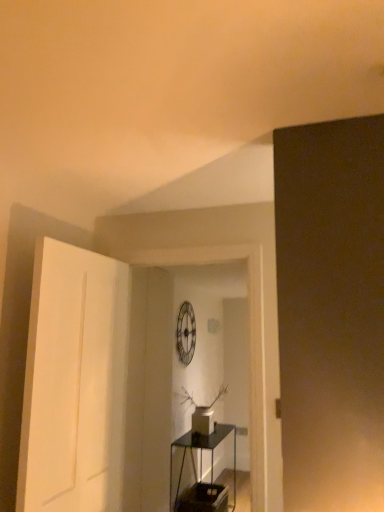
Question: Is white matte door at left positioned beyond the bounds of transparent glass table at center?

Choices:
 (A) yes
 (B) no

Answer: (A)

Question: Is white matte door at left not near transparent glass table at center?

Choices:
 (A) yes
 (B) no

Answer: (A)

Question: Is white matte door at left positioned before transparent glass table at center?

Choices:
 (A) yes
 (B) no

Answer: (A)

Question: Does white matte door at left have a lesser width compared to transparent glass table at center?

Choices:
 (A) yes
 (B) no

Answer: (A)

Question: From the image's perspective, would you say white matte door at left is positioned over transparent glass table at center?

Choices:
 (A) yes
 (B) no

Answer: (A)

Question: Is white matte door at left behind transparent glass table at center?

Choices:
 (A) no
 (B) yes

Answer: (A)

Question: Is transparent glass table at center closer to camera compared to white matte door at left?

Choices:
 (A) no
 (B) yes

Answer: (A)

Question: Is the surface of transparent glass table at center in direct contact with white matte door at left?

Choices:
 (A) no
 (B) yes

Answer: (A)

Question: From a real-world perspective, does transparent glass table at center stand above white matte door at left?

Choices:
 (A) yes
 (B) no

Answer: (B)

Question: Is transparent glass table at center positioned far away from white matte door at left?

Choices:
 (A) yes
 (B) no

Answer: (A)

Question: Is white matte door at left at the back of transparent glass table at center?

Choices:
 (A) yes
 (B) no

Answer: (B)

Question: Can you confirm if transparent glass table at center is thinner than white matte door at left?

Choices:
 (A) no
 (B) yes

Answer: (A)

Question: From the image's perspective, is transparent glass table at center located above or below white matte door at left?

Choices:
 (A) above
 (B) below

Answer: (B)